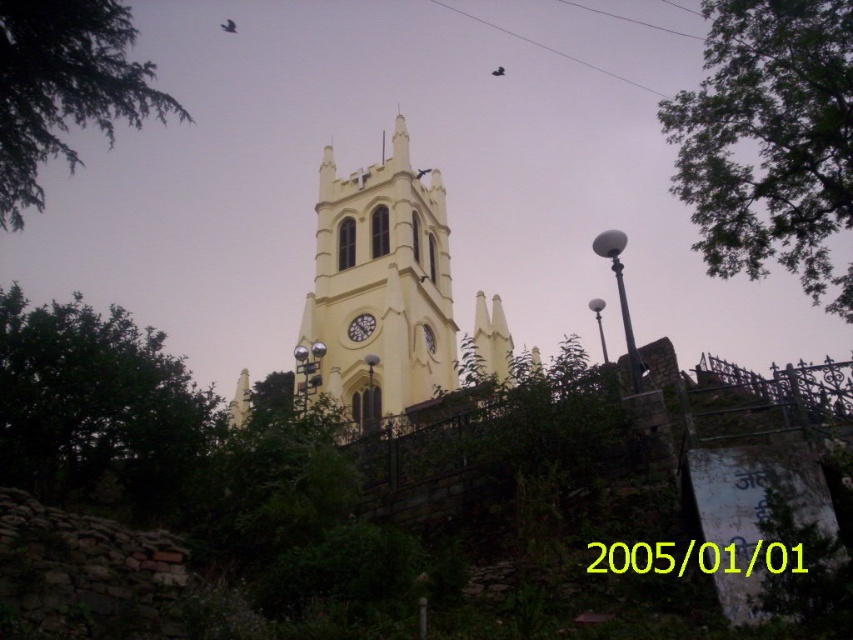
Who is more distant from viewer, (x=172, y=493) or (x=358, y=337)?

The point (x=358, y=337) is behind.

Is green leafy tree at left taller than matte yellow clock at center?

Indeed, green leafy tree at left has a greater height compared to matte yellow clock at center.

This screenshot has height=640, width=853. I want to click on green leafy tree at left, so click(97, 408).

This screenshot has height=640, width=853. Identify the location of green leafy tree at left. (97, 408).

The image size is (853, 640). Find the location of `yellow matte tower at center`. yellow matte tower at center is located at coordinates (381, 285).

Is yellow matte tower at center behind green leafy branch at upper left?

Yes, yellow matte tower at center is further from the viewer.

Does point (401, 164) come farther from viewer compared to point (149, 67)?

Yes, point (401, 164) is farther from viewer.

Identify the location of yellow matte tower at center. (381, 285).

From the picture: Can you confirm if green leafy tree at left is positioned above green leafy branch at upper left?

Actually, green leafy tree at left is below green leafy branch at upper left.

Does green leafy tree at left lie in front of green leafy branch at upper left?

Yes, green leafy tree at left is in front of green leafy branch at upper left.

Between point (99, 444) and point (22, 24), which one is positioned behind?

The point (22, 24) is more distant.

Where is `green leafy tree at left`? Image resolution: width=853 pixels, height=640 pixels. green leafy tree at left is located at coordinates (97, 408).